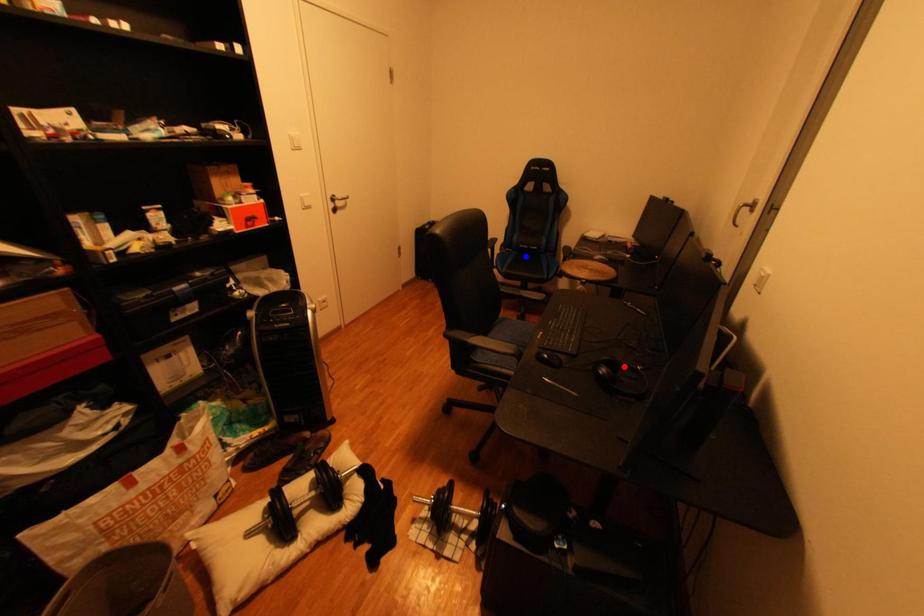
Question: In the image, two points are highlighted. Which point is nearer to the camera? Reply with the corresponding letter.

Choices:
 (A) blue point
 (B) red point

Answer: (B)